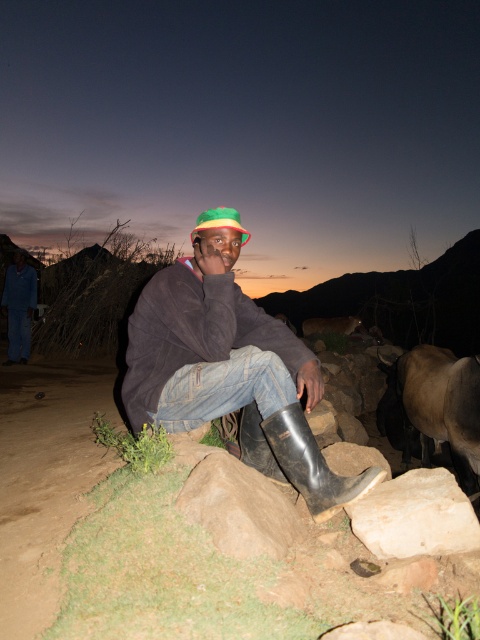
You are standing at the center of the image and want to find the blue denim pants at lower left. In which direction should you look to locate them?

You should look to the left to locate the blue denim pants at lower left because they are positioned at the lower left area of the image.

You are a photographer trying to capture a closeup of the white smooth rock at lower right without including the denim jeans at center in the frame. Given their relative sizes, is this possible?

The denim jeans at center is wider than the white smooth rock at lower right, so it might be challenging to frame the rock without including the jeans if they are positioned closer to the camera. Adjust your angle or distance to ensure the jeans are out of the shot.